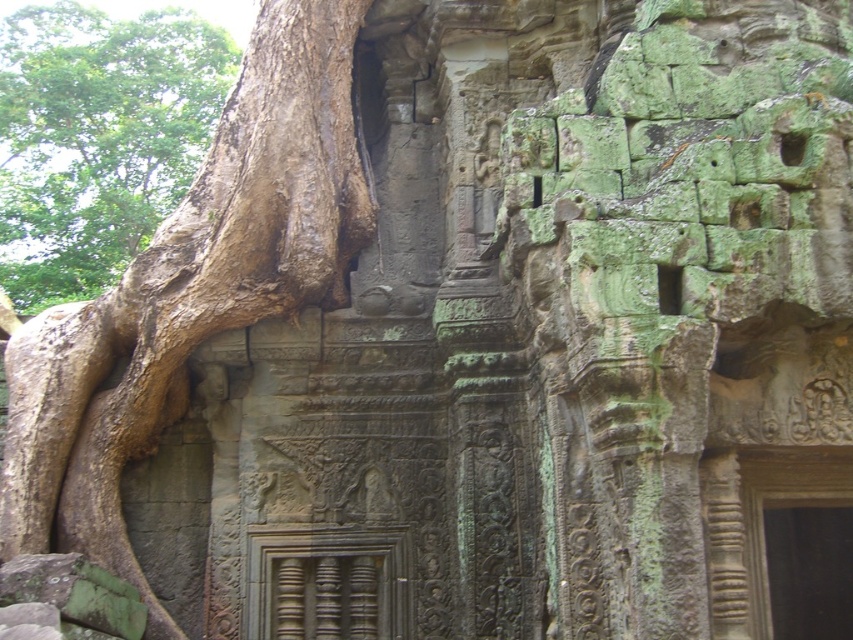
Question: Is brown rough tree trunk at left to the right of brown rough bark at left from the viewer's perspective?

Choices:
 (A) no
 (B) yes

Answer: (B)

Question: Which point is closer to the camera?

Choices:
 (A) brown rough bark at left
 (B) brown rough tree trunk at left

Answer: (B)

Question: Does brown rough tree trunk at left appear under brown rough bark at left?

Choices:
 (A) yes
 (B) no

Answer: (A)

Question: From the image, what is the correct spatial relationship of brown rough tree trunk at left in relation to brown rough bark at left?

Choices:
 (A) below
 (B) above

Answer: (A)